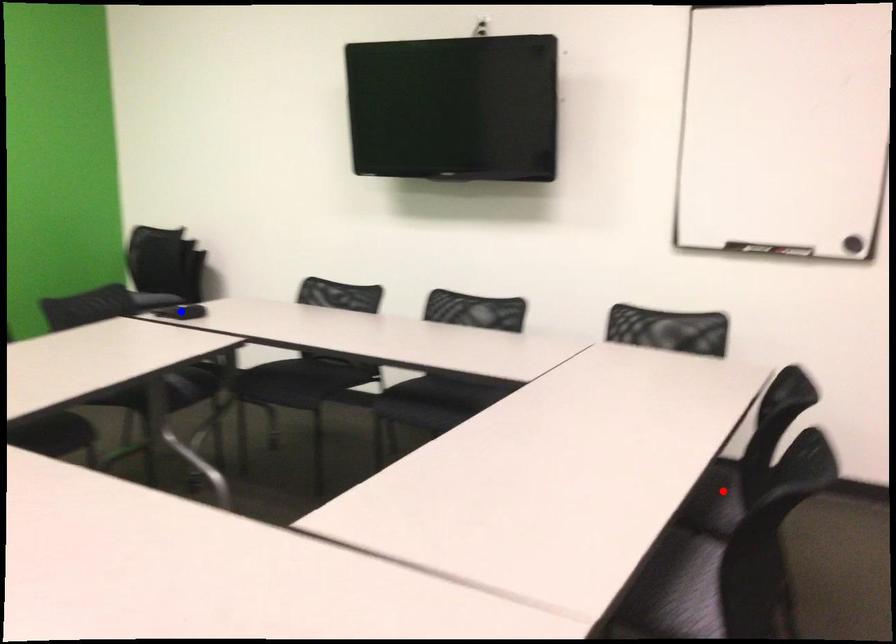
Question: Which of the two points in the image is closer to the camera?

Choices:
 (A) Blue point is closer.
 (B) Red point is closer.

Answer: (B)